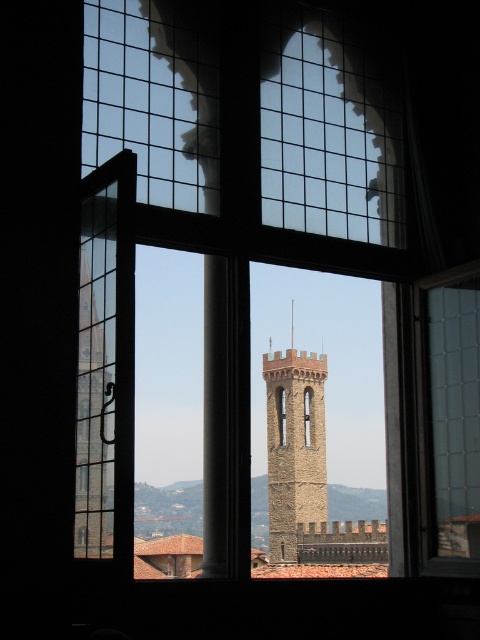
Is point (106, 374) positioned in front of point (323, 461)?

Yes, it is.

Does point (81, 292) come farther from viewer compared to point (296, 356)?

No, (81, 292) is in front of (296, 356).

Find the location of a particular element. stone tower at left is located at coordinates (95, 403).